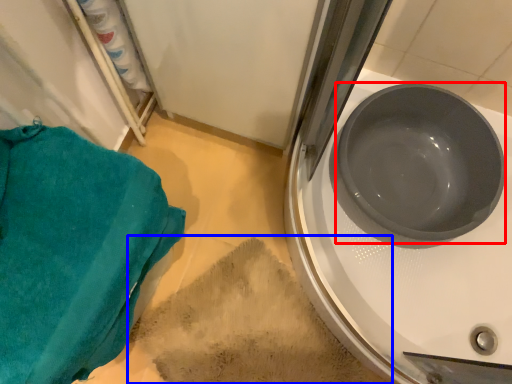
Question: Which of the following is the closest to the observer, basin (highlighted by a red box) or dirt (highlighted by a blue box)?

Choices:
 (A) basin
 (B) dirt

Answer: (A)